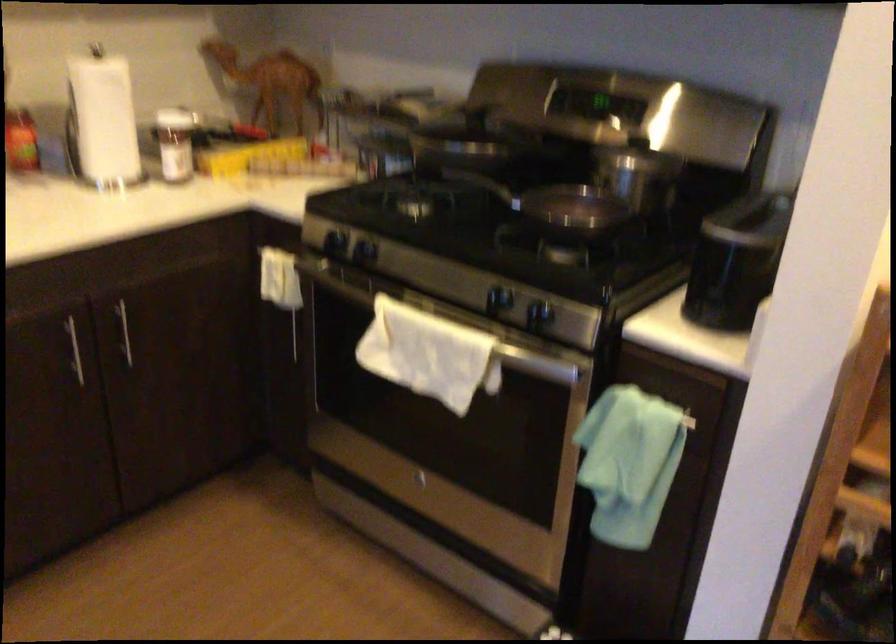
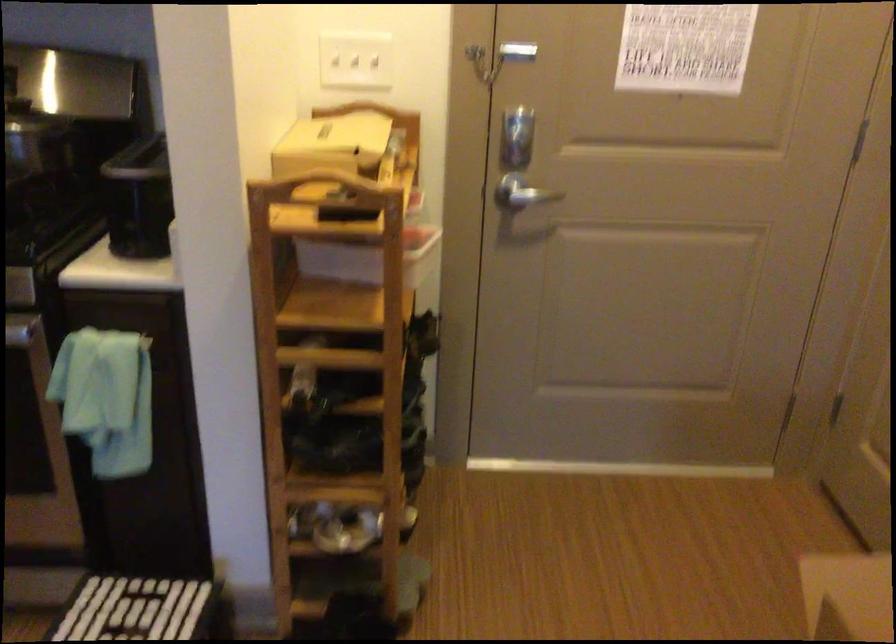
Question: The camera is either moving clockwise (left) or counter-clockwise (right) around the object. The first image is from the beginning of the video and the second image is from the end. Is the camera moving left or right when shooting the video?

Choices:
 (A) Left
 (B) Right

Answer: (A)